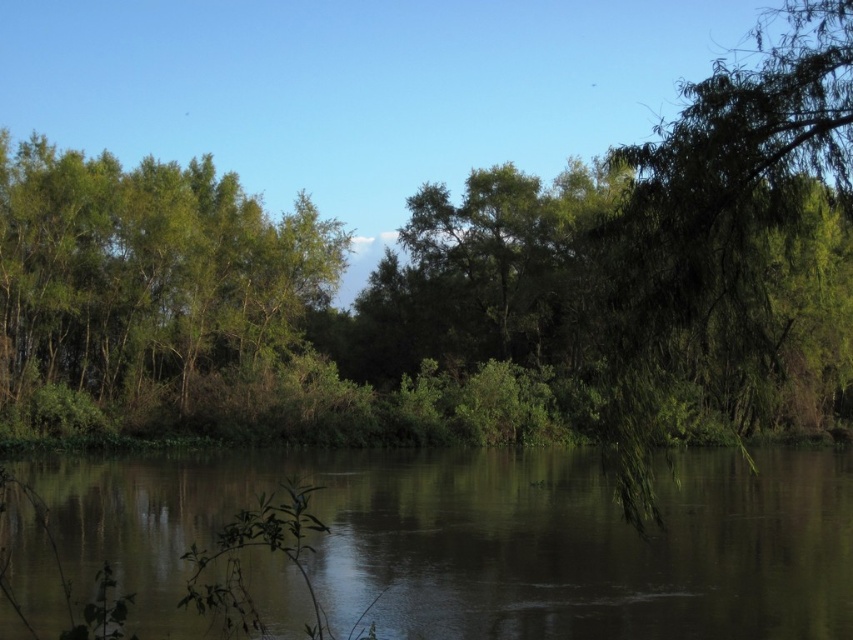
Question: Observing the image, what is the correct spatial positioning of green leafy tree at center in reference to green leafy tree at left?

Choices:
 (A) left
 (B) right

Answer: (B)

Question: Observing the image, what is the correct spatial positioning of brown reflective water at center in reference to green leafy tree at left?

Choices:
 (A) right
 (B) left

Answer: (A)

Question: Considering the relative positions of brown reflective water at center and green leafy tree at left in the image provided, where is brown reflective water at center located with respect to green leafy tree at left?

Choices:
 (A) left
 (B) right

Answer: (B)

Question: Which is farther from the brown reflective water at center?

Choices:
 (A) green leafy tree at left
 (B) green leafy tree at right

Answer: (A)

Question: Based on their relative distances, which object is nearer to the green leafy tree at center?

Choices:
 (A) green leafy tree at left
 (B) green leafy tree at right

Answer: (A)

Question: Considering the real-world distances, which object is closest to the brown reflective water at center?

Choices:
 (A) green leafy tree at right
 (B) green leafy tree at left
 (C) green leafy tree at center

Answer: (A)